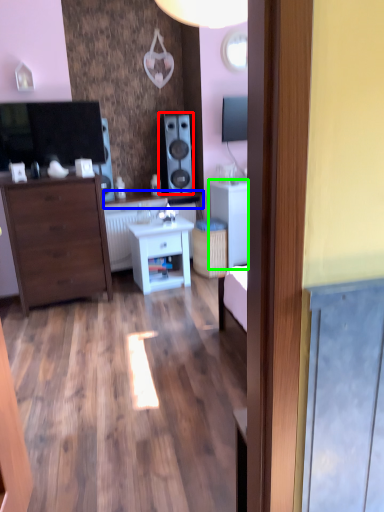
Question: Considering the real-world distances, which object is closest to speaker (highlighted by a red box)? counter top (highlighted by a blue box) or cabinetry (highlighted by a green box).

Choices:
 (A) counter top
 (B) cabinetry

Answer: (A)